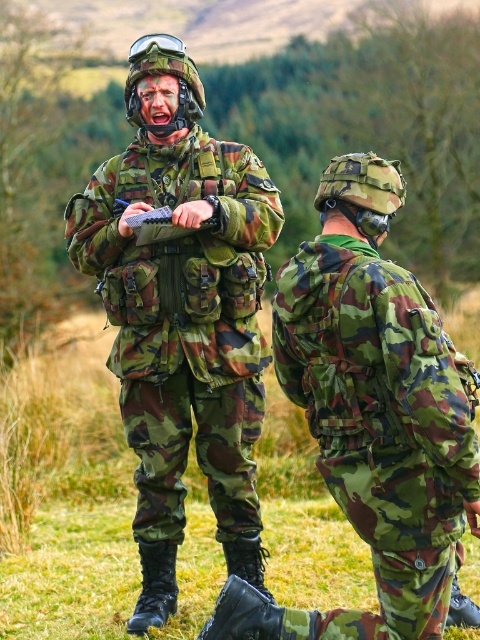
Does camouflage fabric uniform at center appear on the right side of camouflage fabric backpack at center?

No, camouflage fabric uniform at center is not to the right of camouflage fabric backpack at center.

Who is more distant from viewer, (212,156) or (439,406)?

The point (212,156) is behind.

Find the location of a particular element. The width and height of the screenshot is (480, 640). camouflage fabric uniform at center is located at coordinates (181, 314).